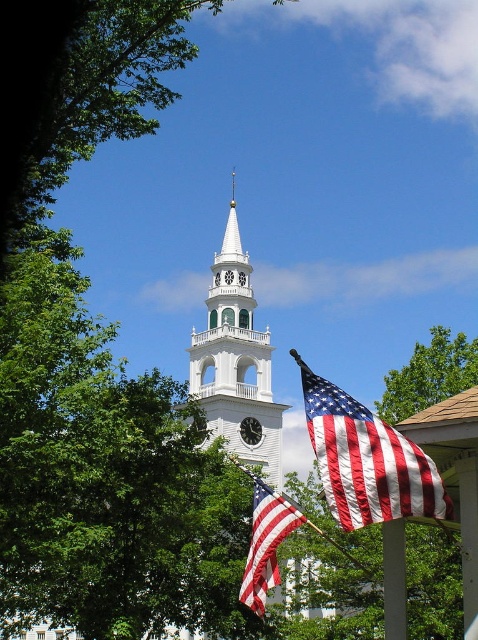
You are a photographer wanting to capture both the green leafy tree at lower right and the metallic flag pole at lower center in the same frame. Based on their widths, do you think you can fit both into your camera viewfinder without moving the camera?

The green leafy tree at lower right might be wider than metallic flag pole at lower center, so there is a possibility that the tree could be too wide to fit alongside the flag pole in the same frame without adjusting the camera position or zoom.